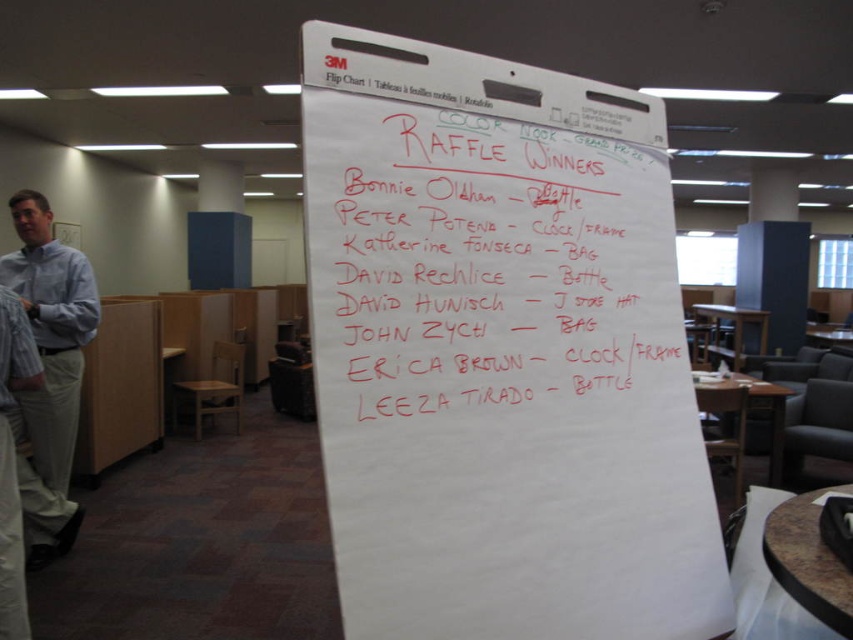
Which of these two, white marker text at center or blue shirt at left, stands shorter?

With less height is white marker text at center.

Does point (590, 198) come behind point (61, 467)?

No.

Where is `white marker text at center`? This screenshot has width=853, height=640. white marker text at center is located at coordinates (495, 273).

Is white paperboard at center to the left of white marker text at center from the viewer's perspective?

Incorrect, white paperboard at center is not on the left side of white marker text at center.

Does white paperboard at center have a greater height compared to white marker text at center?

Correct, white paperboard at center is much taller as white marker text at center.

Is point (676, 392) farther from camera compared to point (483, 196)?

Yes, it is behind point (483, 196).

Identify the location of white paperboard at center. This screenshot has width=853, height=640. (498, 352).

Can you confirm if blue shirt at left is bigger than blue striped shirt at left?

No.

Who is more distant from viewer, (62, 324) or (67, 547)?

The point (67, 547) is more distant.

Which is behind, point (47, 230) or point (24, 416)?

The point (47, 230) is behind.

What are the coordinates of `blue shirt at left` in the screenshot? It's located at (51, 332).